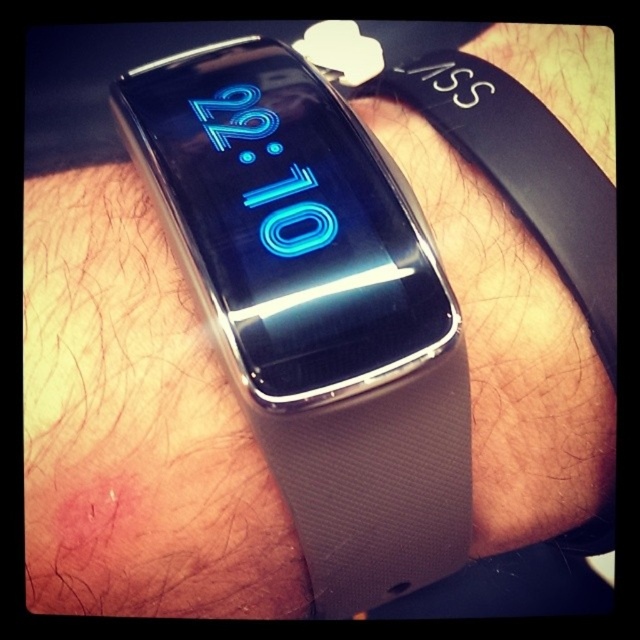
Question: Is white fabric band at center in front of white fabric wristband at center?

Choices:
 (A) yes
 (B) no

Answer: (A)

Question: Which point appears closest to the camera in this image?

Choices:
 (A) (547, 196)
 (B) (460, 344)

Answer: (B)

Question: Does white fabric band at center have a greater width compared to white fabric wristband at center?

Choices:
 (A) no
 (B) yes

Answer: (B)

Question: In this image, where is white fabric band at center located relative to white fabric wristband at center?

Choices:
 (A) left
 (B) right

Answer: (A)

Question: Which point is closer to the camera?

Choices:
 (A) (358, 163)
 (B) (544, 150)

Answer: (A)